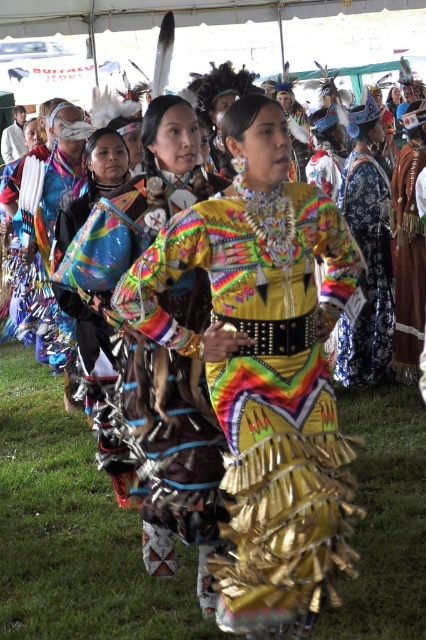
Is point (340, 372) more distant than point (69, 300)?

Yes, point (340, 372) is behind point (69, 300).

Can you confirm if shiny metallic dress at center is smaller than shiny metallic bag at center?

Actually, shiny metallic dress at center might be larger than shiny metallic bag at center.

Is point (347, 205) positioned behind point (108, 138)?

Yes, it is behind point (108, 138).

Locate an element on the screen. This screenshot has height=640, width=426. shiny metallic dress at center is located at coordinates (367, 252).

Is shiny metallic dress at center to the left of brown leather belt at center from the viewer's perspective?

Indeed, shiny metallic dress at center is positioned on the left side of brown leather belt at center.

Looking at this image, who is higher up, shiny metallic dress at center or brown leather belt at center?

shiny metallic dress at center is higher up.

Locate an element on the screen. This screenshot has width=426, height=640. shiny metallic dress at center is located at coordinates (367, 252).

I want to click on shiny metallic dress at center, so click(x=367, y=252).

Can you confirm if multicolored fabric headdress at upper left is thinner than brown leather belt at center?

In fact, multicolored fabric headdress at upper left might be wider than brown leather belt at center.

Is multicolored fabric headdress at upper left closer to the viewer compared to brown leather belt at center?

Yes, multicolored fabric headdress at upper left is closer to the viewer.

The height and width of the screenshot is (640, 426). Identify the location of multicolored fabric headdress at upper left. tap(48, 244).